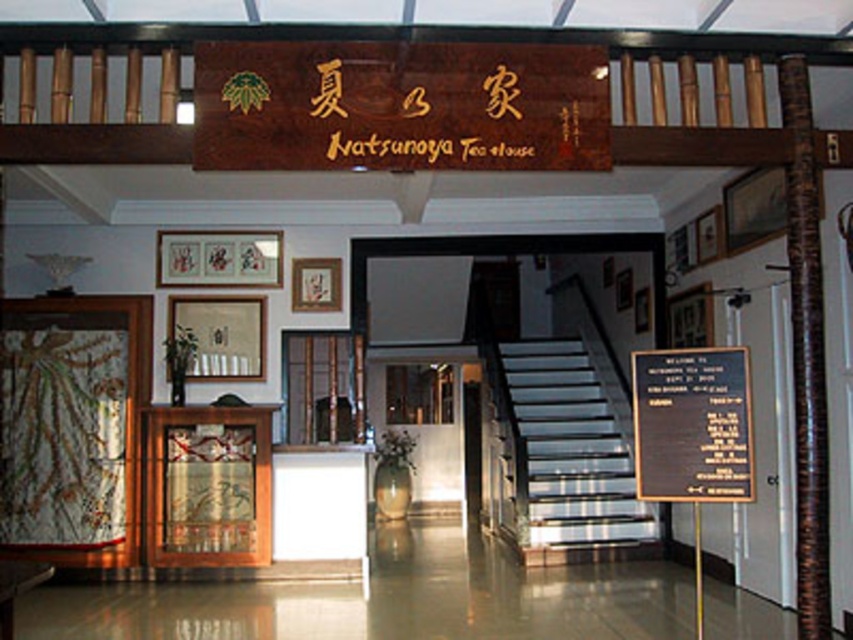
You are standing at the entrance of Natsunoya Tea House and want to go to the second floor. The metallic staircase at center is your only option. Can you reach it without moving past the entrance area?

The metallic staircase at center is located at point (572, 445), which is within the entrance area, so yes, you can reach it without moving past the entrance area.

You are a visitor entering Natsunoya Tea House and need to reach the second floor. The entrance has a metallic staircase at center and a black wood sign at center. Which one is wider?

The metallic staircase at center is wider than the black wood sign at center.